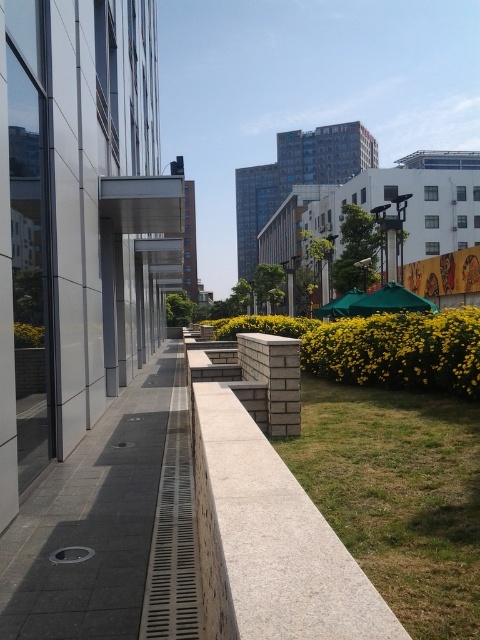
Which is above, green grass at lower right or gray concrete pavement at center?

green grass at lower right is above.

Who is more forward, (362, 456) or (34, 545)?

Positioned in front is point (34, 545).

You are a GUI agent. You are given a task and a screenshot of the screen. Output one action in this format:
    pyautogui.click(x=<x>, y=<y>)
    Task: Click on the green grass at lower right
    
    Given the screenshot: What is the action you would take?
    pyautogui.click(x=398, y=496)

Image resolution: width=480 pixels, height=640 pixels. I want to click on green grass at lower right, so click(x=398, y=496).

Who is shorter, gray stone ledge at center or green grass at lower right?

green grass at lower right is shorter.

Can you confirm if gray stone ledge at center is wider than green grass at lower right?

No, gray stone ledge at center is not wider than green grass at lower right.

Is point (272, 352) closer to camera compared to point (415, 577)?

No, (272, 352) is behind (415, 577).

You are a GUI agent. You are given a task and a screenshot of the screen. Output one action in this format:
    pyautogui.click(x=<x>, y=<y>)
    Task: Click on the gray stone ledge at center
    
    Given the screenshot: What is the action you would take?
    pyautogui.click(x=266, y=509)

Is gray stone ledge at center to the left of gray concrete pavement at center from the viewer's perspective?

In fact, gray stone ledge at center is to the right of gray concrete pavement at center.

You are a GUI agent. You are given a task and a screenshot of the screen. Output one action in this format:
    pyautogui.click(x=<x>, y=<y>)
    Task: Click on the gray stone ledge at center
    The height and width of the screenshot is (640, 480).
    Given the screenshot: What is the action you would take?
    pyautogui.click(x=266, y=509)